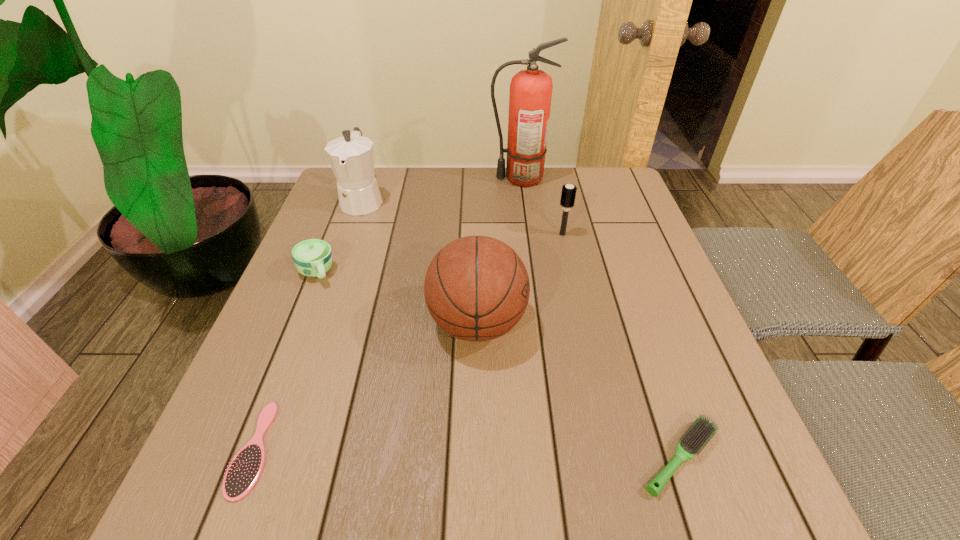
You are a GUI agent. You are given a task and a screenshot of the screen. Output one action in this format:
    pyautogui.click(x=<x>, y=<y>)
    Task: Click on the fire extinguisher at the far edge
    The height and width of the screenshot is (540, 960).
    Given the screenshot: What is the action you would take?
    pyautogui.click(x=530, y=96)

The width and height of the screenshot is (960, 540). Find the location of `coffeepot that is at the far edge`. coffeepot that is at the far edge is located at coordinates (351, 157).

Locate an element on the screen. The image size is (960, 540). coffeepot that is at the left edge is located at coordinates (351, 157).

Find the location of a particular element. This screenshot has height=540, width=960. cup present at the left edge is located at coordinates (313, 258).

Locate an element on the screen. hairbrush that is at the left edge is located at coordinates (245, 469).

Locate an element on the screen. The height and width of the screenshot is (540, 960). object positioned at the right edge is located at coordinates (702, 430).

Where is `object at the far left corner`? The height and width of the screenshot is (540, 960). object at the far left corner is located at coordinates (351, 157).

This screenshot has width=960, height=540. What are the coordinates of `object at the near left corner` in the screenshot? It's located at [x=245, y=469].

You are a GUI agent. You are given a task and a screenshot of the screen. Output one action in this format:
    pyautogui.click(x=<x>, y=<y>)
    Task: Click on the object that is at the near right corner
    The image size is (960, 540).
    Given the screenshot: What is the action you would take?
    pyautogui.click(x=702, y=430)

Identify the location of vacant area at the far edge of the desktop. The width and height of the screenshot is (960, 540). (438, 170).